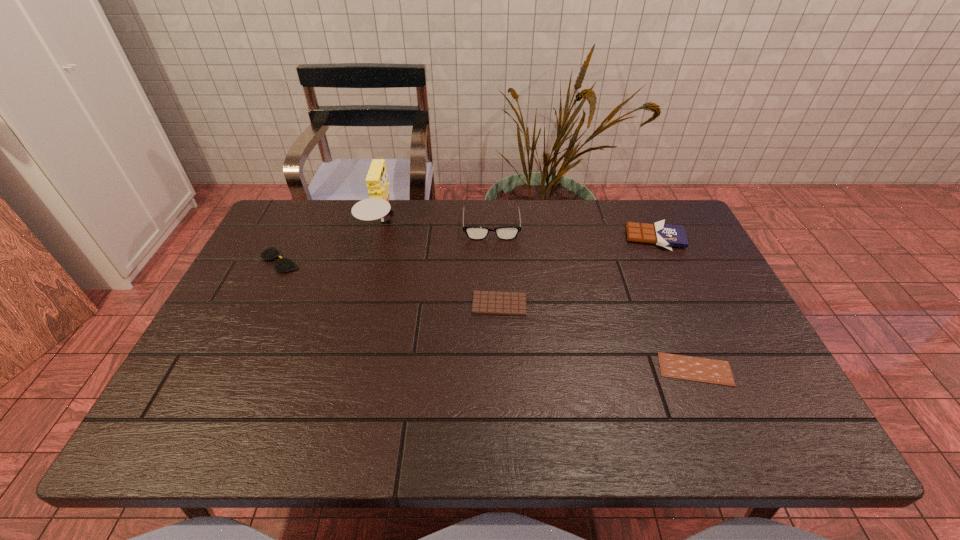
The height and width of the screenshot is (540, 960). What are the coordinates of `chocolate bar at the far edge` in the screenshot? It's located at (665, 235).

At what (x,y) coordinates should I click in order to perform the action: click on object that is at the left edge. Please return your answer as a coordinate pair (x, y). Looking at the image, I should click on (283, 265).

The width and height of the screenshot is (960, 540). In order to click on object located at the far right corner in this screenshot , I will do `click(665, 235)`.

You are a GUI agent. You are given a task and a screenshot of the screen. Output one action in this format:
    pyautogui.click(x=<x>, y=<y>)
    Task: Click on the vacant region at the far edge of the desktop
    The width and height of the screenshot is (960, 540).
    Given the screenshot: What is the action you would take?
    pyautogui.click(x=433, y=214)

The width and height of the screenshot is (960, 540). In the image, there is a desktop. Find the location of `vacant space at the near edge`. vacant space at the near edge is located at coordinates (288, 433).

In the image, there is a desktop. In order to click on free space at the left edge in this screenshot , I will do `click(228, 308)`.

Locate an element on the screen. This screenshot has height=540, width=960. vacant space at the right edge is located at coordinates (700, 307).

In the image, there is a desktop. Where is `vacant region at the far left corner`? The image size is (960, 540). vacant region at the far left corner is located at coordinates (299, 240).

In the image, there is a desktop. At what (x,y) coordinates should I click in order to perform the action: click on free space at the near left corner. Please return your answer as a coordinate pair (x, y). Looking at the image, I should click on (193, 418).

Where is `vacant space at the near right corner`? Image resolution: width=960 pixels, height=540 pixels. vacant space at the near right corner is located at coordinates (791, 429).